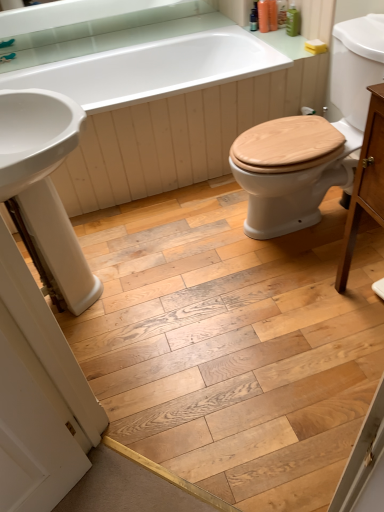
In order to click on vacant space in front of white glossy sink at left in this screenshot , I will do `click(135, 370)`.